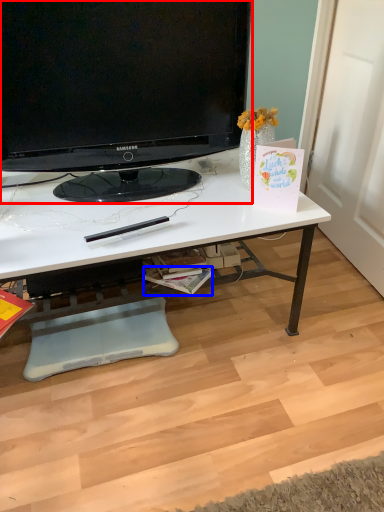
Question: Which point is further to the camera, television (highlighted by a red box) or magazine (highlighted by a blue box)?

Choices:
 (A) television
 (B) magazine

Answer: (B)